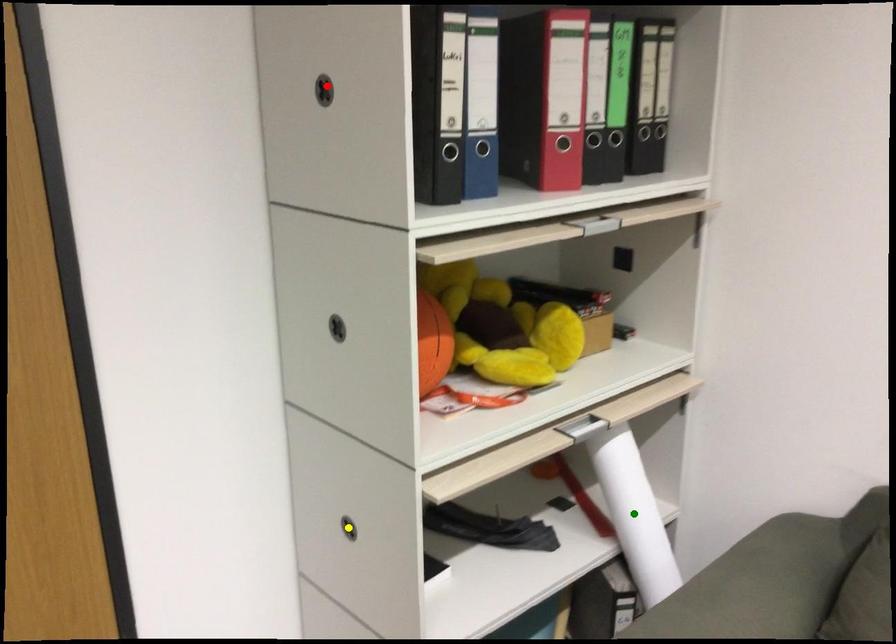
Order these from farthest to nearest:
red point | yellow point | green point

green point → yellow point → red point